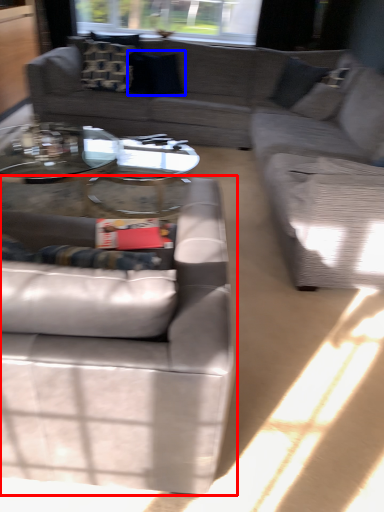
Question: Which object is closer to the camera taking this photo, studio couch (highlighted by a red box) or pillow (highlighted by a blue box)?

Choices:
 (A) studio couch
 (B) pillow

Answer: (A)